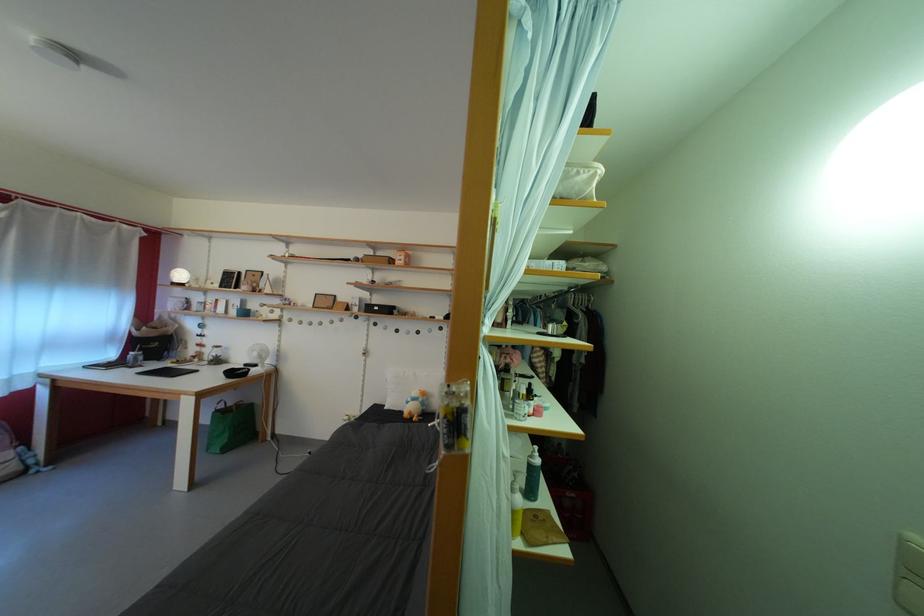
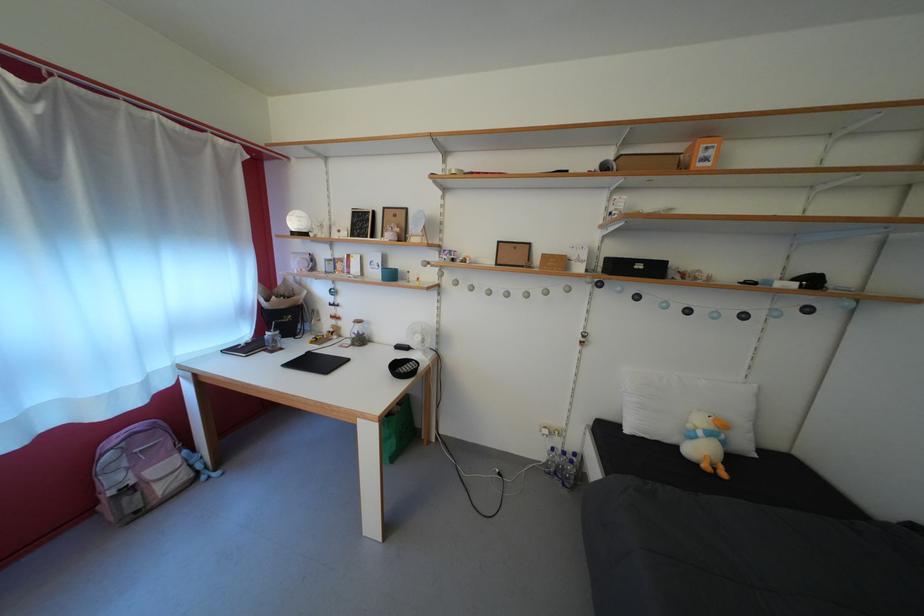
In the second image, find the point that corresponds to the point at 219,360 in the first image.

(358, 334)